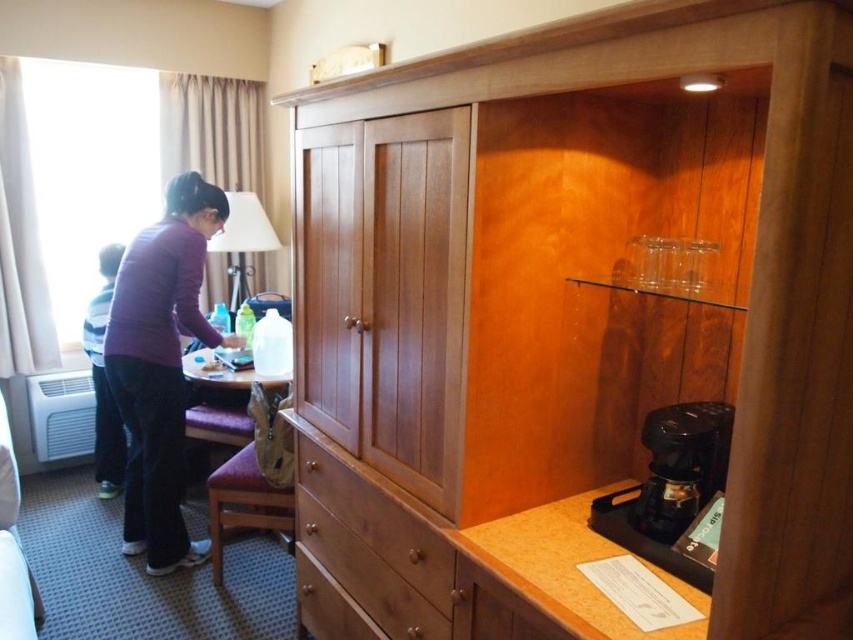
You are a delivery person who needs to place a 40 cm wide package between the wooden dresser at center and the black plastic coffee machine at lower right. Can you fit it there?

The distance between the wooden dresser at center and the black plastic coffee machine at lower right is 41.59 centimeters. Since the package is 40 cm wide, it should fit with about 1.59 centimeters of space remaining.

You are a guest in this hotel room and need to sit down. There is a purple fabric shirt at left and a brown leather stool at lower center. Which object can you sit on?

The brown leather stool at lower center is the object you can sit on because the purple fabric shirt at left is positioned over it and not meant for sitting.